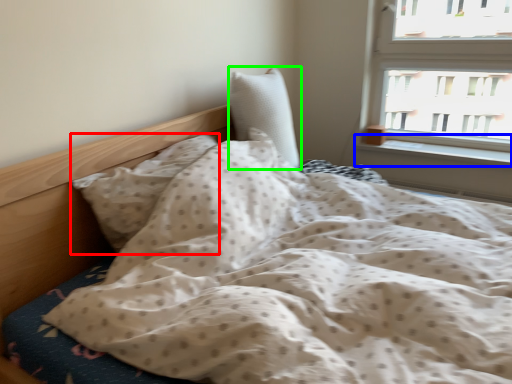
Question: Considering the real-world distances, which object is farthest from pillow (highlighted by a red box)? window sill (highlighted by a blue box) or pillow (highlighted by a green box)?

Choices:
 (A) window sill
 (B) pillow

Answer: (A)